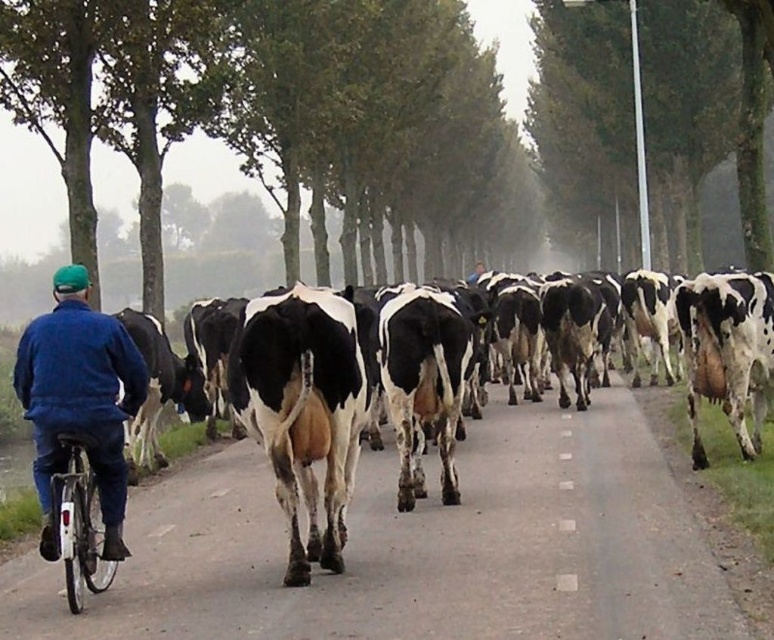
You are standing at the camera position and want to throw a ball to the person wearing the blue fleece jacket at left. The ball has a maximum throwing range of 5 meters. Can you reach them?

The distance between the blue fleece jacket at left and the camera is 5.85 meters, which exceeds the ball throwing range of 5 meters. Therefore, you cannot reach them.

You are standing at the camera position and want to throw a treat to the cow closest to you. Which point, point (x=124, y=496) or point (x=62, y=513), is closer to you?

Point (x=124, y=496) is closer to you because it is further to the camera than point (x=62, y=513).